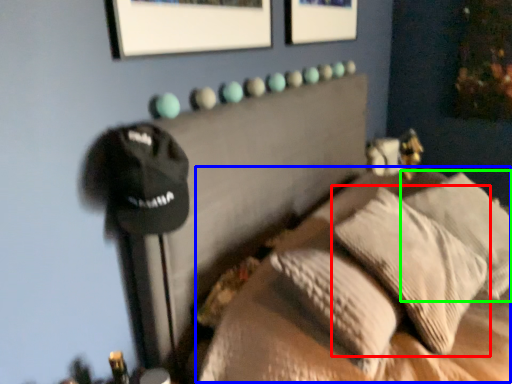
Question: Based on their relative distances, which object is farther from pillow (highlighted by a red box)? Choose from bed (highlighted by a blue box) and pillow (highlighted by a green box).

Choices:
 (A) bed
 (B) pillow

Answer: (B)